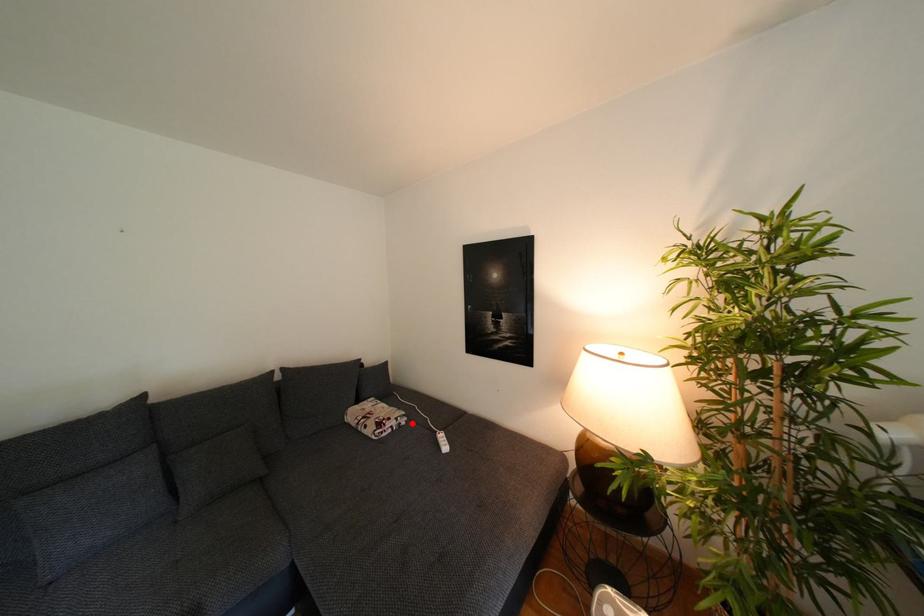
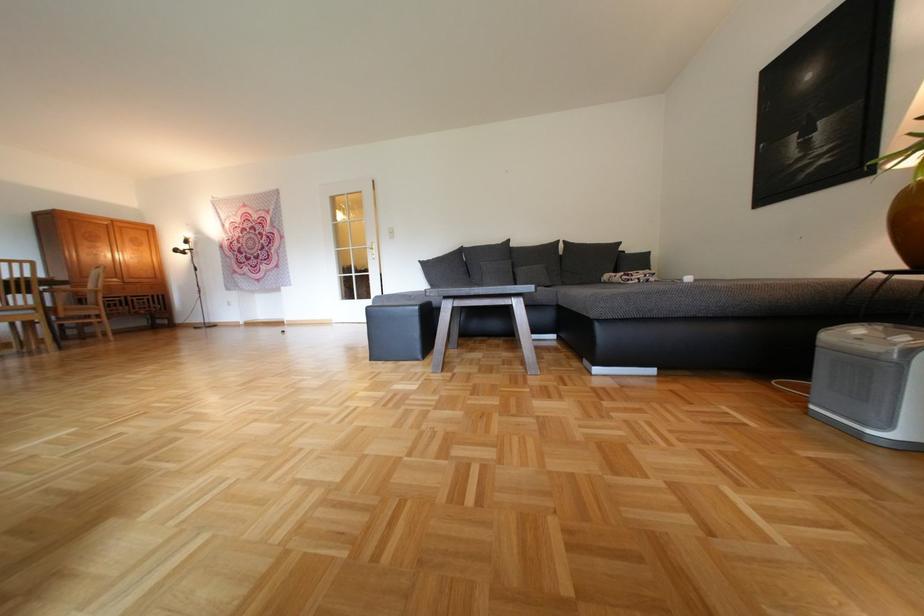
Locate, in the second image, the point that corresponds to the highlighted location in the first image.

(661, 280)